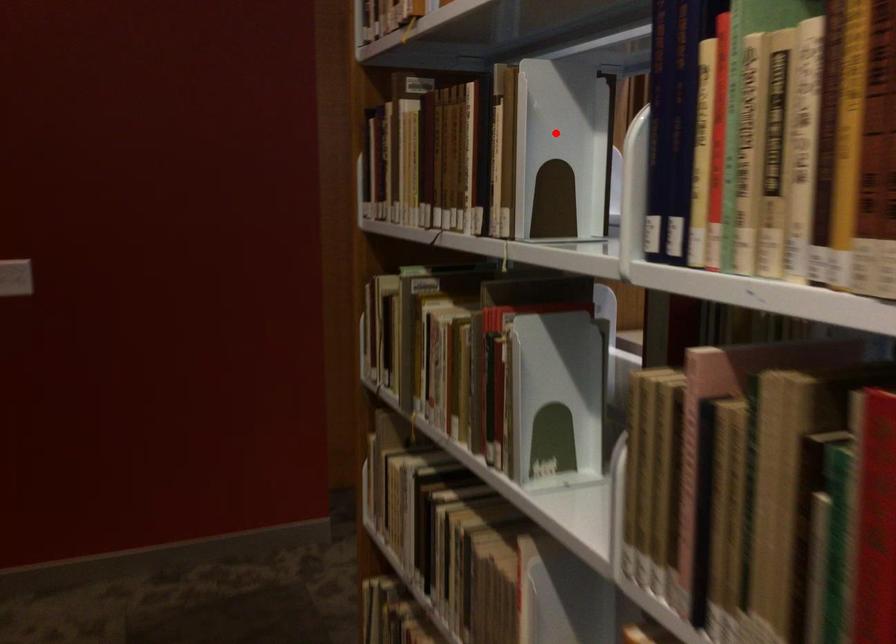
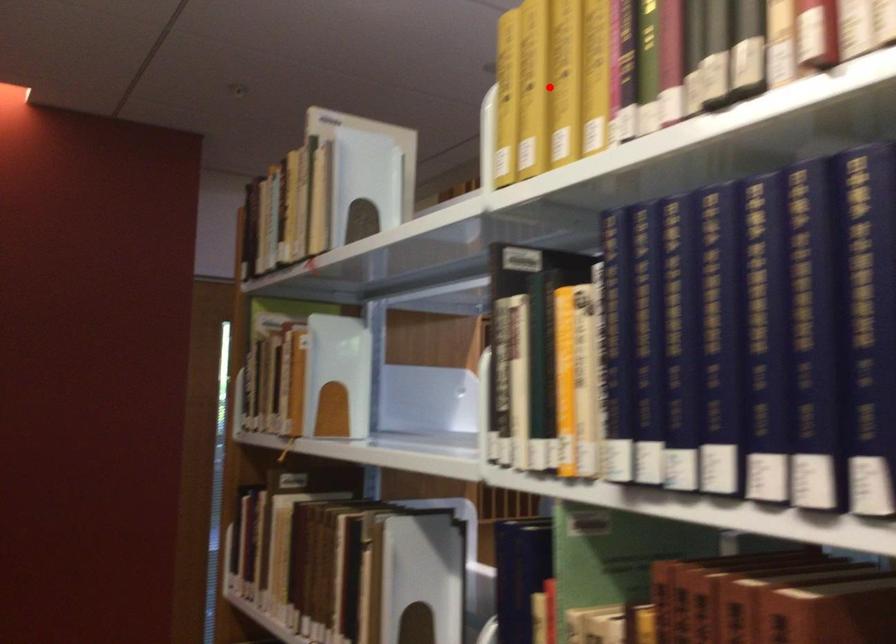
I am providing you with two images of the same scene from different viewpoints. A red point is marked on the first image and another point is marked on the second image. Do the highlighted points in image1 and image2 indicate the same real-world spot?

No